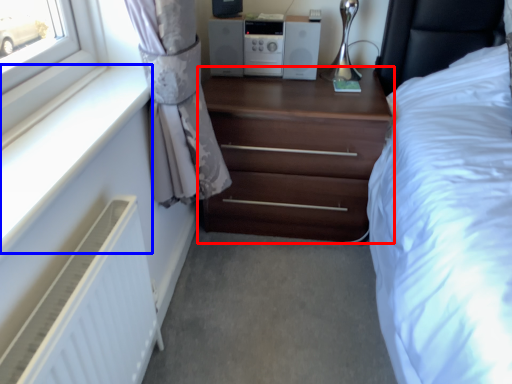
Question: Which of the following is the closest to the observer, chest of drawers (highlighted by a red box) or window sill (highlighted by a blue box)?

Choices:
 (A) chest of drawers
 (B) window sill

Answer: (B)